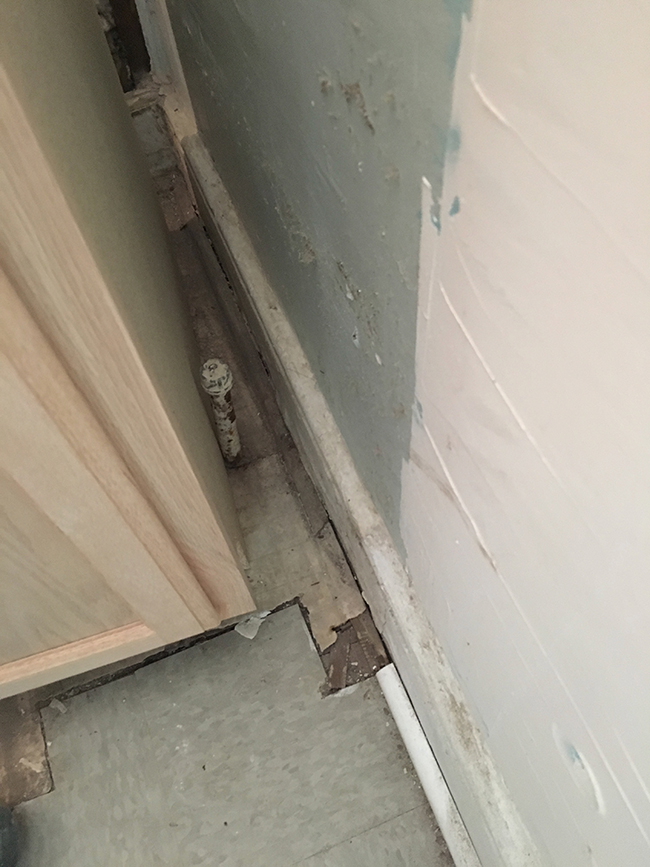
At what (x,y) coordinates should I click in order to perform the action: click on lower right hand corner of door. Please return your answer as a coordinate pair (x, y). The width and height of the screenshot is (650, 867). Looking at the image, I should click on (x=150, y=596).